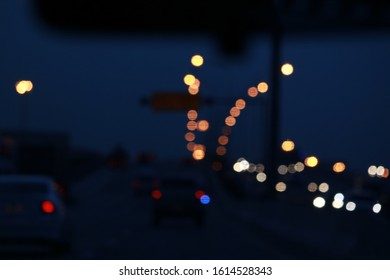
You are a GUI agent. You are given a task and a screenshot of the screen. Output one action in this format:
    pyautogui.click(x=<x>, y=<y>)
    Task: Click on the light
    
    Given the screenshot: What is the action you would take?
    pyautogui.click(x=28, y=85)